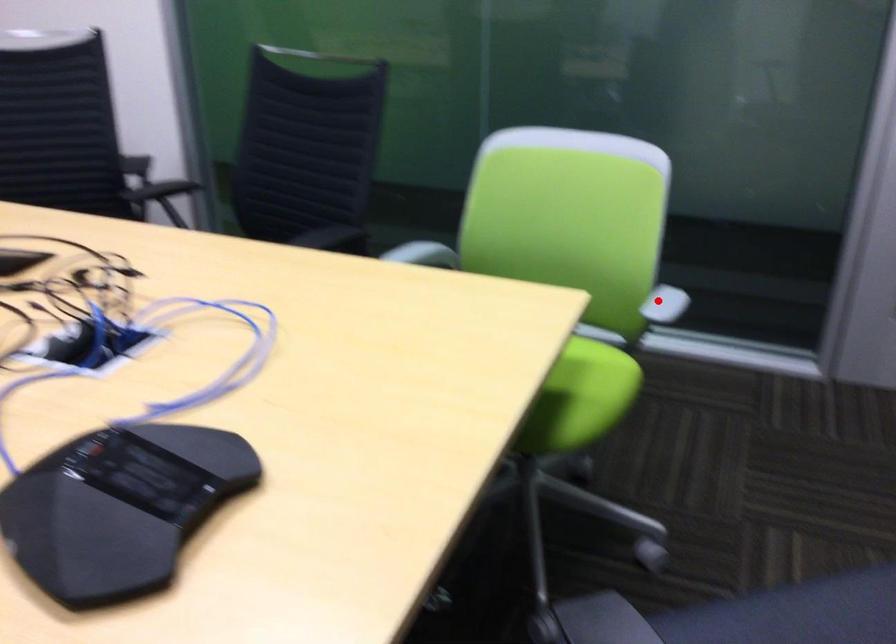
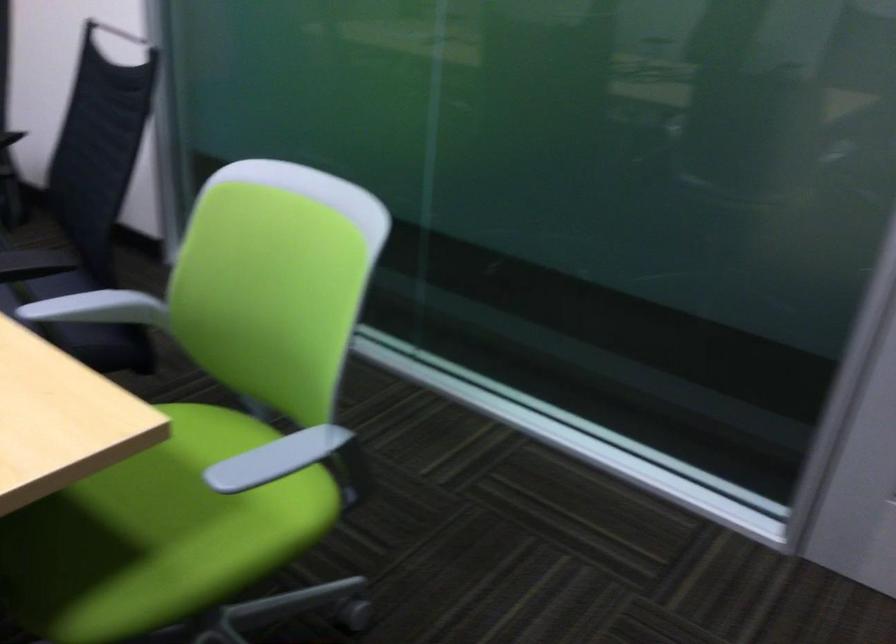
Find the pixel in the second image that matches the highlighted location in the first image.

(276, 458)